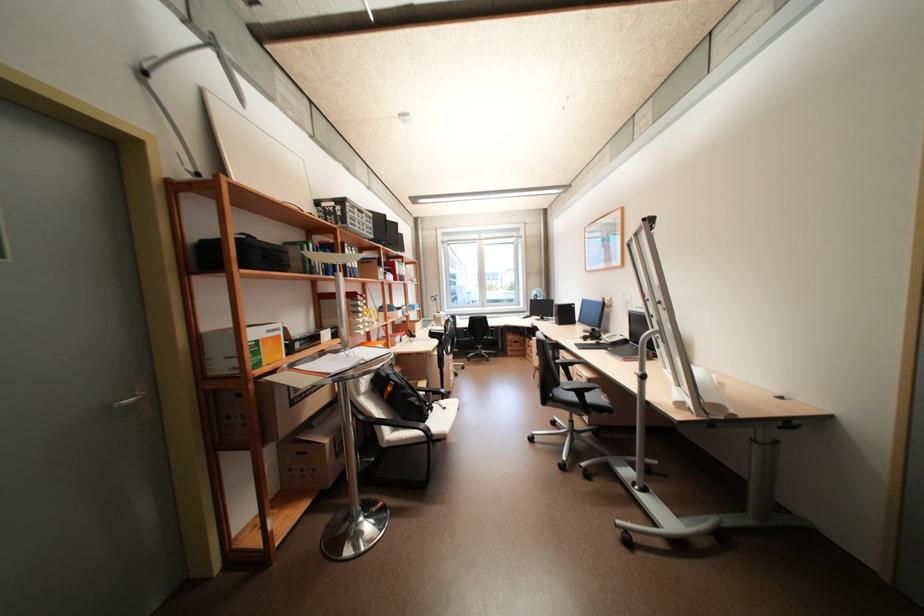
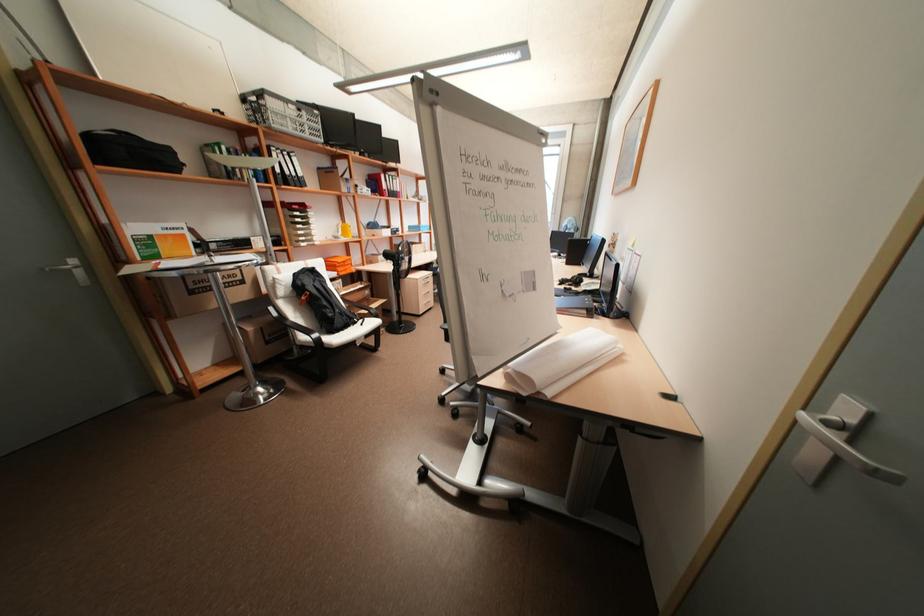
Locate, in the second image, the point that corresponds to (322,204) in the first image.

(249, 99)